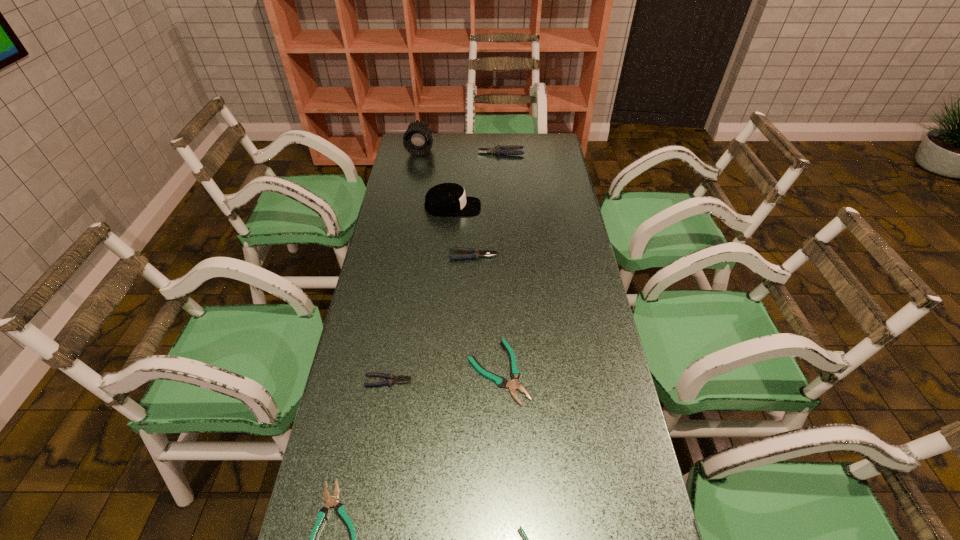
I want to click on telephoto lens positioned at the far edge, so click(417, 140).

Identify the location of pliers positioned at the far edge. click(x=507, y=150).

The width and height of the screenshot is (960, 540). What are the coordinates of `telephoto lens situated at the left edge` in the screenshot? It's located at (417, 140).

Image resolution: width=960 pixels, height=540 pixels. In order to click on cap that is positioned at the left edge in this screenshot , I will do (443, 199).

Locate an element on the screen. The height and width of the screenshot is (540, 960). pliers that is at the left edge is located at coordinates click(391, 378).

Locate an element on the screen. This screenshot has height=540, width=960. object present at the far left corner is located at coordinates (417, 140).

At what (x,y) coordinates should I click in order to perform the action: click on vacant area at the left edge. Please return your answer as a coordinate pair (x, y). Looking at the image, I should click on [x=376, y=377].

Locate an element on the screen. vacant region at the right edge is located at coordinates (546, 259).

Where is `free location at the far right corner of the desktop`? free location at the far right corner of the desktop is located at coordinates (535, 156).

I want to click on free space that is in between the black telephoto lens and the leftmost gray pliers, so click(x=404, y=265).